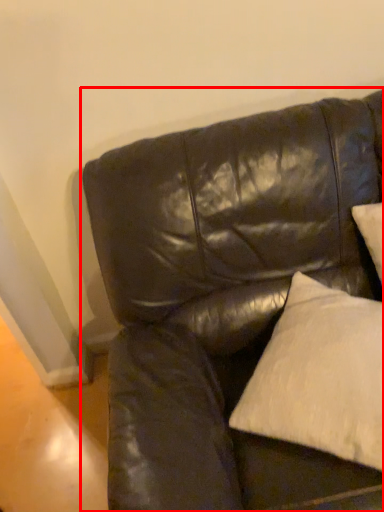
Question: Considering the relative positions of studio couch (annotated by the red box) and pillow in the image provided, where is studio couch (annotated by the red box) located with respect to the staircase?

Choices:
 (A) left
 (B) right

Answer: (A)